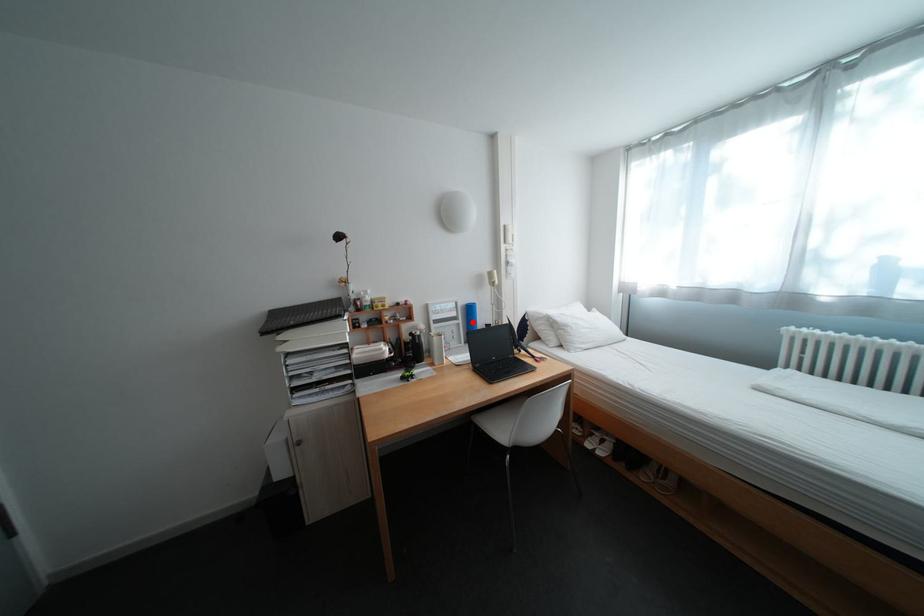
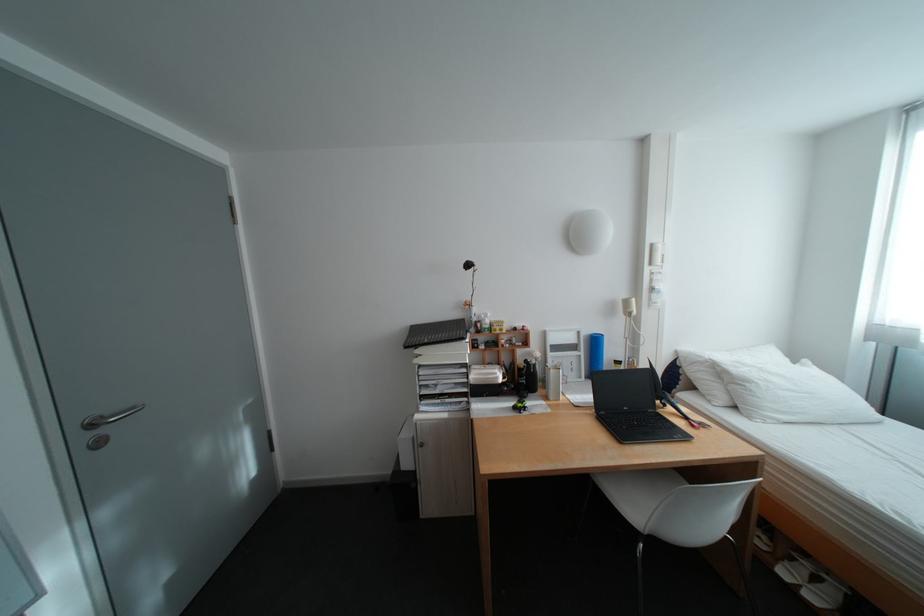
Locate, in the second image, the point that corresponds to the highlighted location in the first image.

(594, 354)